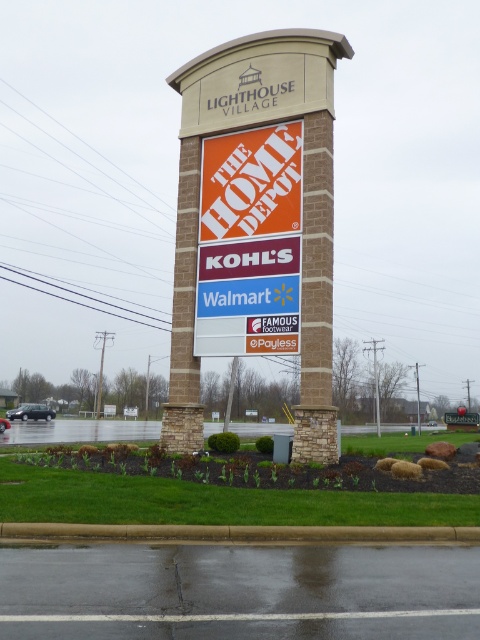
Does point (457, 417) come behind point (2, 432)?

That is True.

Does matte orange sign at center have a lesser width compared to black rubber car at center?

Yes.

Is point (469, 417) closer to viewer compared to point (2, 429)?

That is False.

This screenshot has height=640, width=480. Identify the location of matte orange sign at center. pyautogui.click(x=460, y=419).

Is orangematerialsignage at center above black matte car at lower left?

Yes.

Find the location of a particular element. The width and height of the screenshot is (480, 640). orangematerialsignage at center is located at coordinates (250, 243).

Which is in front, point (216, 352) or point (16, 416)?

Point (216, 352) is in front.

Find the location of a particular element. The image size is (480, 640). orangematerialsignage at center is located at coordinates (250, 243).

Who is shorter, black matte car at lower left or matte orange sign at center?

matte orange sign at center is shorter.

Is black matte car at lower left positioned in front of matte orange sign at center?

Yes, it is.

Find the location of a particular element. The image size is (480, 640). black matte car at lower left is located at coordinates (31, 412).